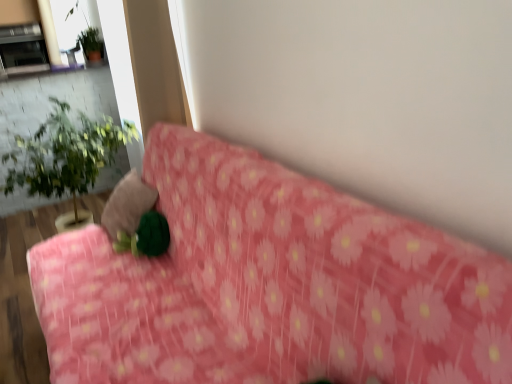
Question: Does pink floral fabric at center have a lesser height compared to green leafy plant at left?

Choices:
 (A) yes
 (B) no

Answer: (A)

Question: Considering the relative sizes of pink floral fabric at center and green leafy plant at left in the image provided, is pink floral fabric at center thinner than green leafy plant at left?

Choices:
 (A) yes
 (B) no

Answer: (A)

Question: From the image's perspective, does pink floral fabric at center appear higher than green leafy plant at left?

Choices:
 (A) yes
 (B) no

Answer: (B)

Question: Can you confirm if pink floral fabric at center is smaller than green leafy plant at left?

Choices:
 (A) yes
 (B) no

Answer: (B)

Question: Is the position of pink floral fabric at center more distant than that of green leafy plant at left?

Choices:
 (A) yes
 (B) no

Answer: (B)

Question: Considering the relative sizes of pink floral fabric at center and green leafy plant at left in the image provided, is pink floral fabric at center taller than green leafy plant at left?

Choices:
 (A) yes
 (B) no

Answer: (B)

Question: From the image's perspective, is pink floral fabric at center above metallic silver fireplace at upper left?

Choices:
 (A) no
 (B) yes

Answer: (A)

Question: Is pink floral fabric at center completely or partially outside of metallic silver fireplace at upper left?

Choices:
 (A) yes
 (B) no

Answer: (A)

Question: Is pink floral fabric at center far away from metallic silver fireplace at upper left?

Choices:
 (A) yes
 (B) no

Answer: (A)

Question: Is pink floral fabric at center taller than metallic silver fireplace at upper left?

Choices:
 (A) no
 (B) yes

Answer: (B)

Question: Could you tell me if pink floral fabric at center is turned towards metallic silver fireplace at upper left?

Choices:
 (A) no
 (B) yes

Answer: (A)

Question: Is metallic silver fireplace at upper left inside pink floral fabric at center?

Choices:
 (A) no
 (B) yes

Answer: (A)

Question: Does velvety green pillow at center contain pink floral fabric at center?

Choices:
 (A) yes
 (B) no

Answer: (B)